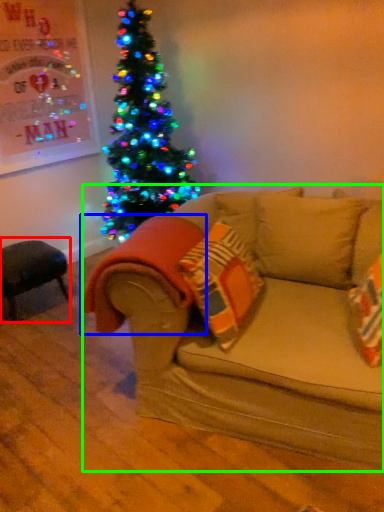
Question: Considering the real-world distances, which object is closest to swivel chair (highlighted by a red box)? blanket (highlighted by a blue box) or studio couch (highlighted by a green box).

Choices:
 (A) blanket
 (B) studio couch

Answer: (A)